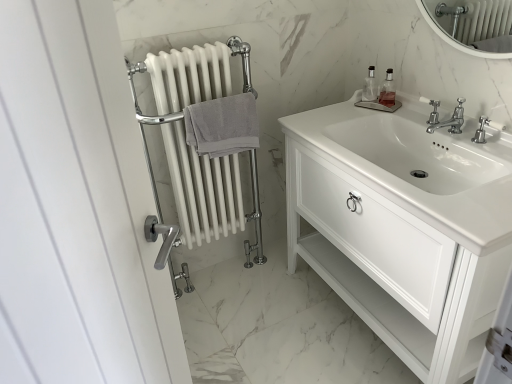
Identify the location of vacant area on the back side of polished chrome faucet at center. The width and height of the screenshot is (512, 384). (414, 122).